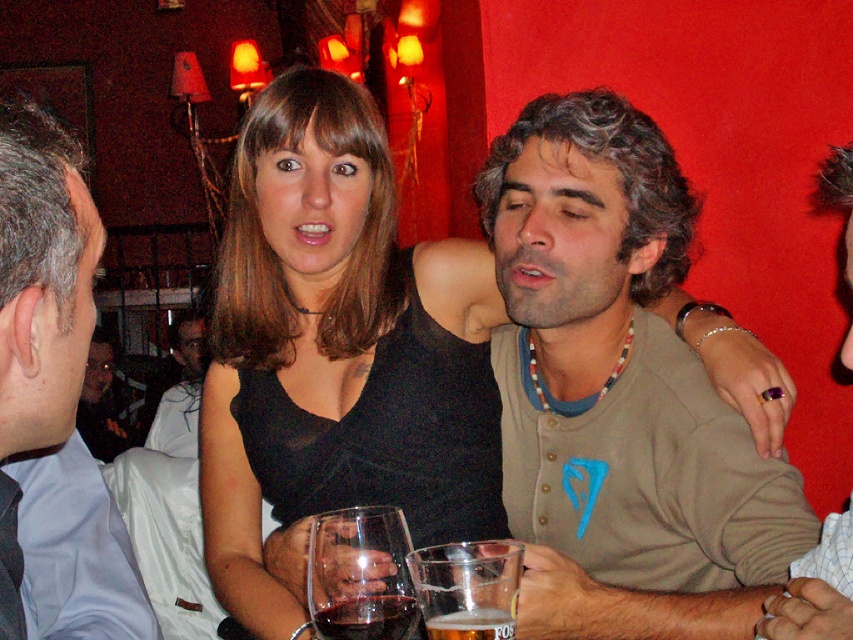
Question: Is the position of gray hair at left more distant than that of dark glass at lower center?

Choices:
 (A) yes
 (B) no

Answer: (B)

Question: Considering the relative positions of matte gray sweater at center and foamy golden beer at lower center in the image provided, where is matte gray sweater at center located with respect to foamy golden beer at lower center?

Choices:
 (A) below
 (B) above

Answer: (B)

Question: Which point is farther to the camera?

Choices:
 (A) (843, 538)
 (B) (115, 579)

Answer: (B)

Question: Which point appears closest to the camera in this image?

Choices:
 (A) (473, 625)
 (B) (323, 609)
 (C) (567, 109)

Answer: (A)

Question: From the image, what is the correct spatial relationship of transparent glass at lower center in relation to purple ring at upper right?

Choices:
 (A) below
 (B) above

Answer: (A)

Question: Among these objects, which one is nearest to the camera?

Choices:
 (A) matte gray sweater at center
 (B) foamy golden beer at lower center

Answer: (B)